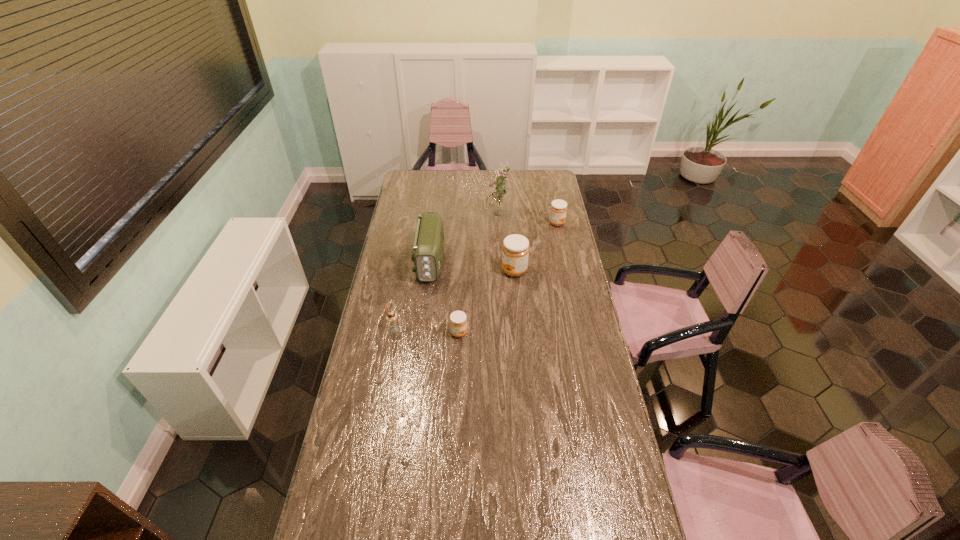
With all jams evenly spaced, where should an extra jam be placed on the left to continue the pattern? Please point out a vacant space. Please provide its 2D coordinates. Your answer should be formatted as a tuple, i.e. [(x, y)], where the tuple contains the x and y coordinates of a point satisfying the conditions above.

[(383, 417)]